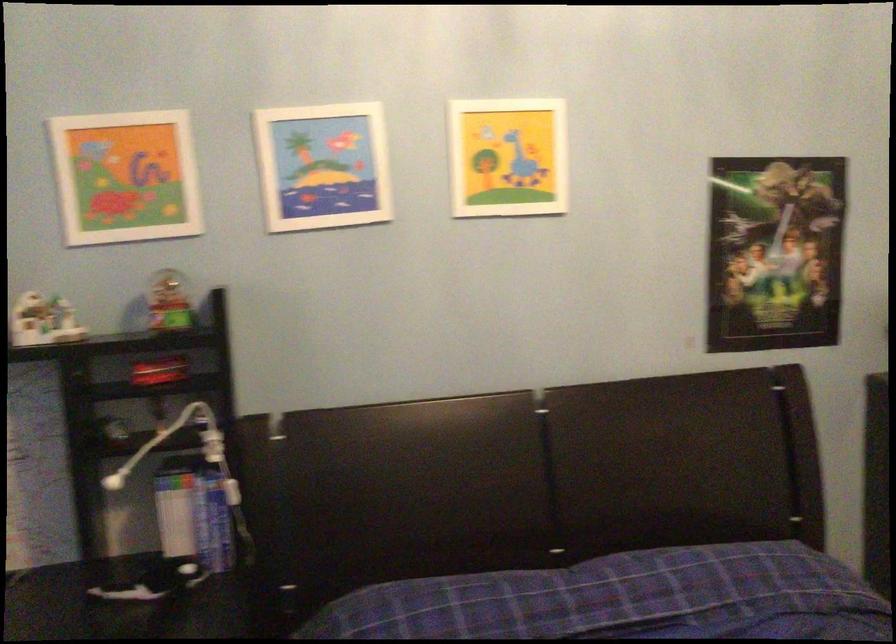
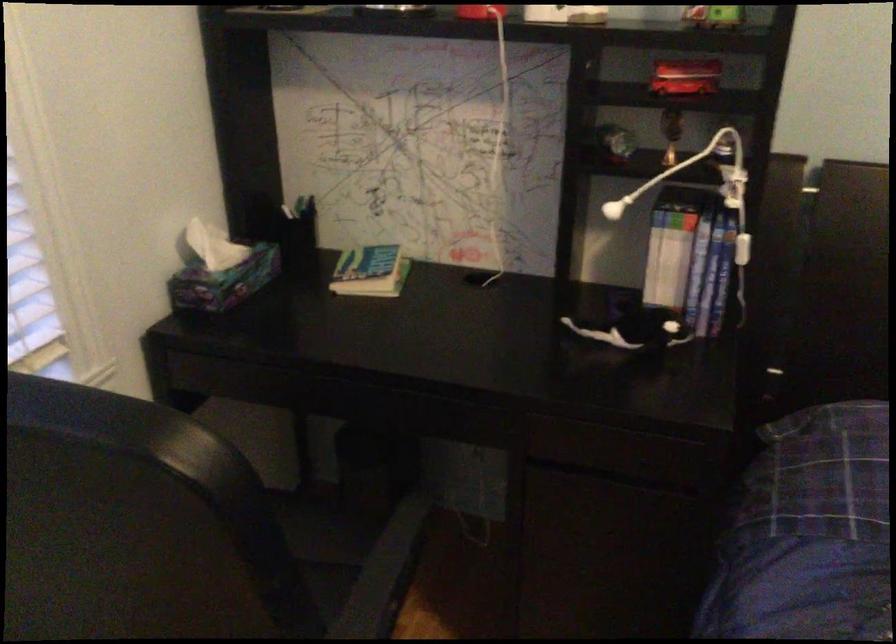
In the second image, find the point that corresponds to (159,368) in the first image.

(685, 77)